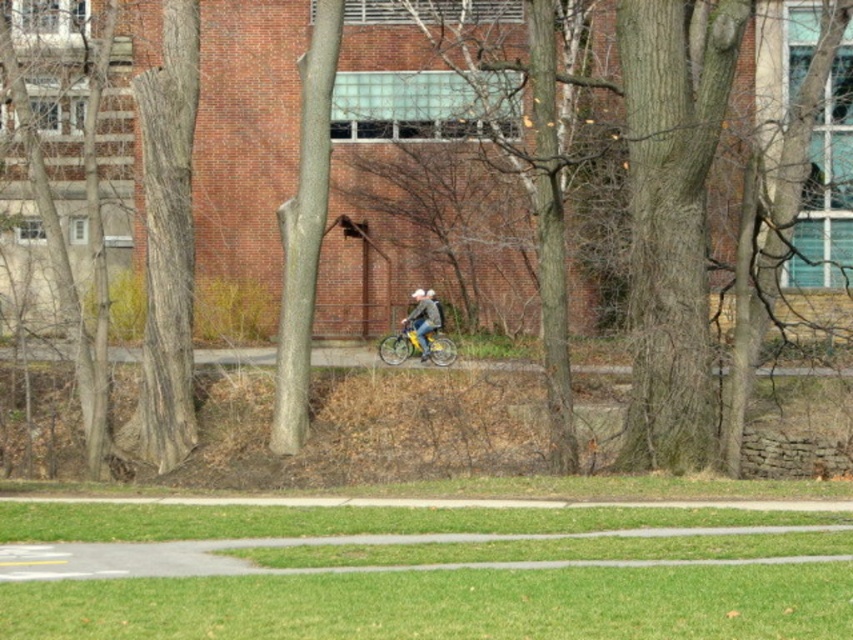
You are standing at point (434, 321) and want to walk to the yellow bicycle with black tires. Which direction should you go to reach it first, towards point (416, 326) or away from it?

You should go towards point (416, 326) because it is in front of your current position at point (434, 321), so moving towards it will lead you closer to the yellow bicycle with black tires.

You are standing at the starting point of a path bordered by trees and grass. You see a yellow matte bicycle at center. If you want to reach the bicycle as quickly as possible, should you walk straight ahead or turn left?

The yellow matte bicycle at center is 130.49 feet from viewer. Walking straight ahead will allow you to reach the yellow matte bicycle at center faster since it is directly in front of you.

You are standing at the point marked by the coordinates point (416, 346) in the image. What object are you directly at?

The point (416, 346) indicates the yellow matte bicycle at center, so you are directly at the yellow matte bicycle at center.